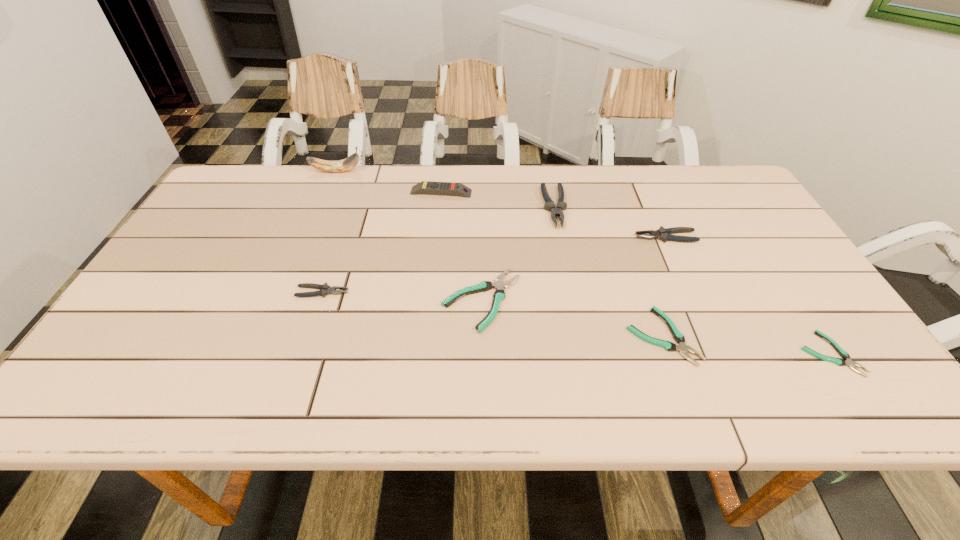
Locate an element on the screen. The width and height of the screenshot is (960, 540). vacant area situated 0.230m at the gripping part of the fourth tallest object is located at coordinates (552, 237).

Identify the location of blank space located 0.220m at the gripping part of the leftmost gray pliers. The image size is (960, 540). click(x=439, y=292).

Image resolution: width=960 pixels, height=540 pixels. I want to click on vacant space situated 0.280m on the back of the third shortest object, so click(481, 205).

The width and height of the screenshot is (960, 540). I want to click on vacant point located 0.260m on the left of the second shortest pliers, so click(x=512, y=336).

Identify the location of free space located on the left of the shortest pliers. This screenshot has width=960, height=540. (669, 354).

Where is `banana at the far edge`? banana at the far edge is located at coordinates (346, 164).

This screenshot has width=960, height=540. Find the location of `pliers located at the far edge`. pliers located at the far edge is located at coordinates (549, 205).

Where is `remote control situated at the far edge`? This screenshot has width=960, height=540. remote control situated at the far edge is located at coordinates (449, 188).

What are the coordinates of `object present at the near edge` in the screenshot? It's located at (840, 362).

I want to click on object present at the right edge, so (840, 362).